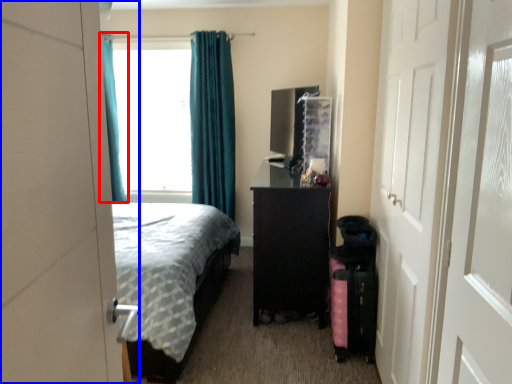
Question: Among these objects, which one is nearest to the camera, curtain (highlighted by a red box) or door (highlighted by a blue box)?

Choices:
 (A) curtain
 (B) door

Answer: (B)